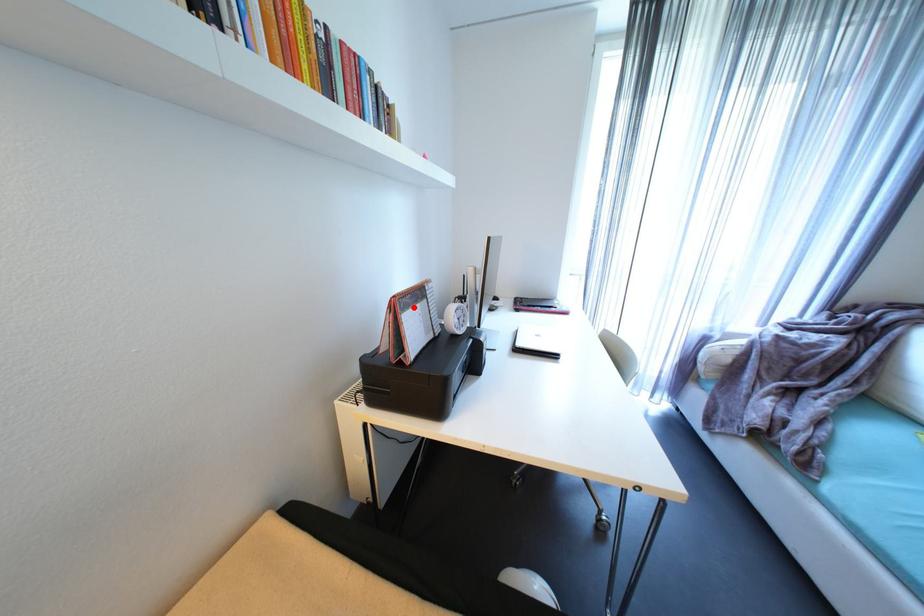
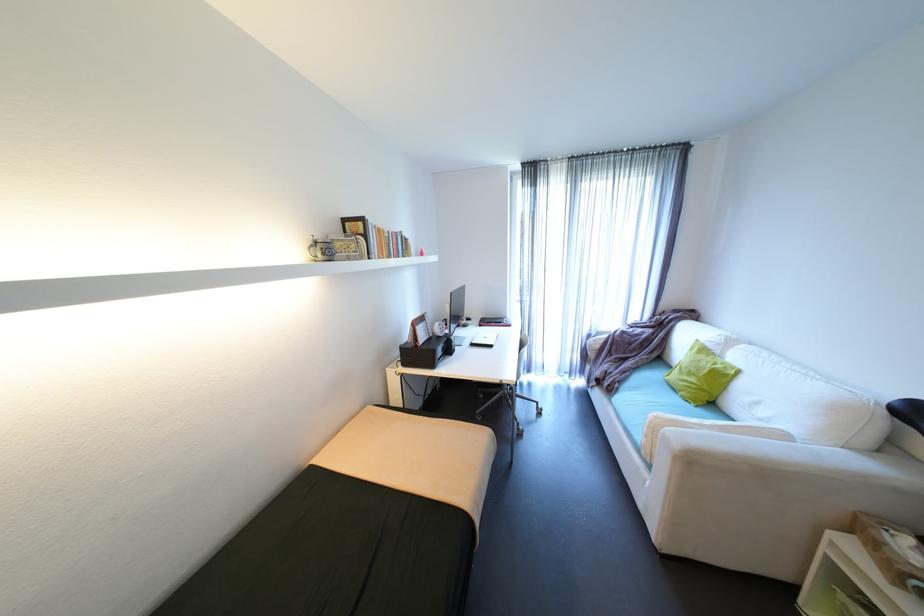
Where in the second image is the point corresponding to the highlighted location from the first image?

(426, 323)